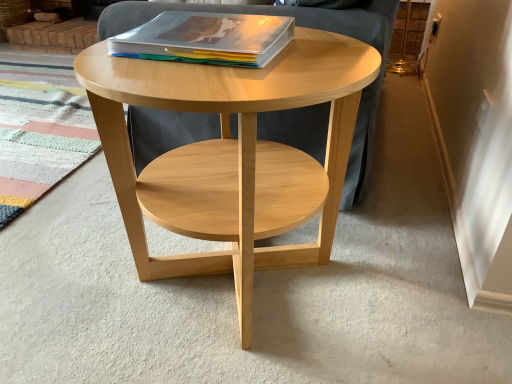
This screenshot has width=512, height=384. In order to click on unoccupied area in front of matte plastic magazine at center in this screenshot , I will do `click(198, 83)`.